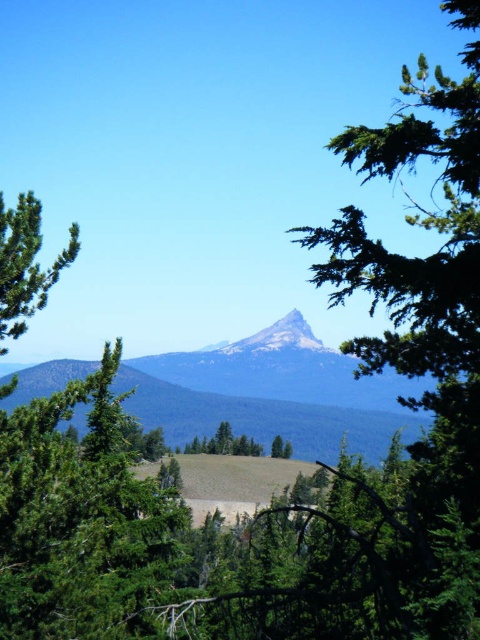
You are an outdoor photographer planning to capture a wide landscape shot. You have a camera with a 35mm lens that can capture a maximum width of 50 meters. The smooth gray mountain at center and the green matte tree at center are both in your frame. Based on their widths, will the mountain and tree fit within the lens width capacity?

The smooth gray mountain at center is wider than the green matte tree at center. Since the mountain is wider, and the total combined width of both objects would exceed the 50 meters capacity of the 35mm lens, they might not fit within the lens width capacity. However, if the mountain alone is under 50 meters in width, it could fit. The exact width of each object isnecessary to determine this precisely.

Looking at this image, you are an artist planning to paint the scene. You want to ensure the smooth gray mountain at center and the green matte tree at center are proportionally accurate. Which object should you make larger in your painting?

The smooth gray mountain at center should be made larger than the green matte tree at center in the painting since it is described as larger in size.